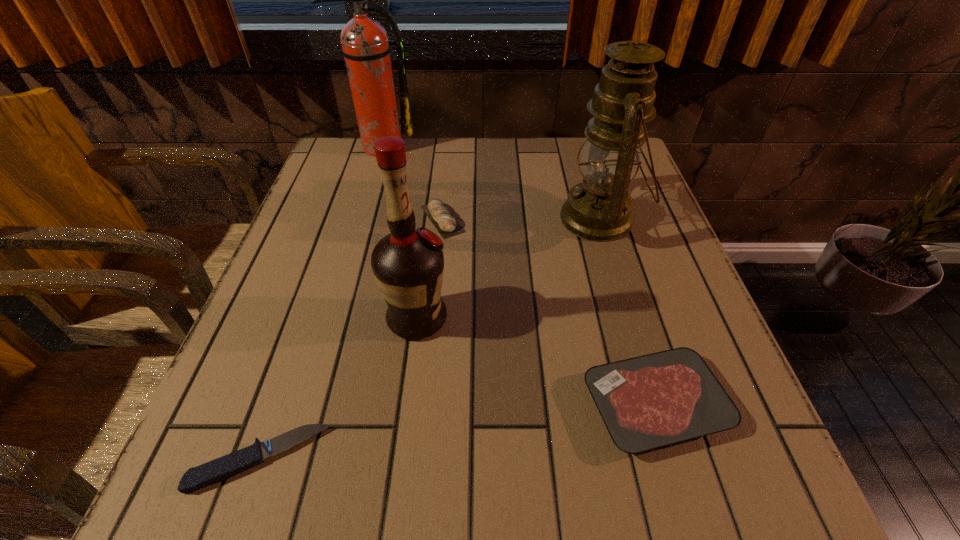
The height and width of the screenshot is (540, 960). I want to click on the farthest object, so click(365, 46).

Find the location of a particular element. The height and width of the screenshot is (540, 960). oil lamp is located at coordinates (599, 209).

Where is `the third nearest object`? Image resolution: width=960 pixels, height=540 pixels. the third nearest object is located at coordinates (408, 265).

Where is `the third shortest object`? The height and width of the screenshot is (540, 960). the third shortest object is located at coordinates (446, 224).

The image size is (960, 540). What are the coordinates of `the second shortest object` in the screenshot? It's located at (655, 400).

You are a GUI agent. You are given a task and a screenshot of the screen. Output one action in this format:
    pyautogui.click(x=<x>, y=<y>)
    Task: Click on the shortest object
    The height and width of the screenshot is (540, 960).
    Given the screenshot: What is the action you would take?
    pyautogui.click(x=195, y=478)

The height and width of the screenshot is (540, 960). Find the location of `vacant region located at the nozzle of the fire extinguisher`. vacant region located at the nozzle of the fire extinguisher is located at coordinates (366, 194).

I want to click on vacant space located 0.320m on the front of the oil lamp, so click(652, 390).

At what (x,y) coordinates should I click in order to perform the action: click on blank area located on the front and back of the liquor. Please return your answer as a coordinate pair (x, y). The width and height of the screenshot is (960, 540). Looking at the image, I should click on (653, 319).

Find the location of a particular element. vacant position located 0.070m on the left of the pita bread is located at coordinates (389, 219).